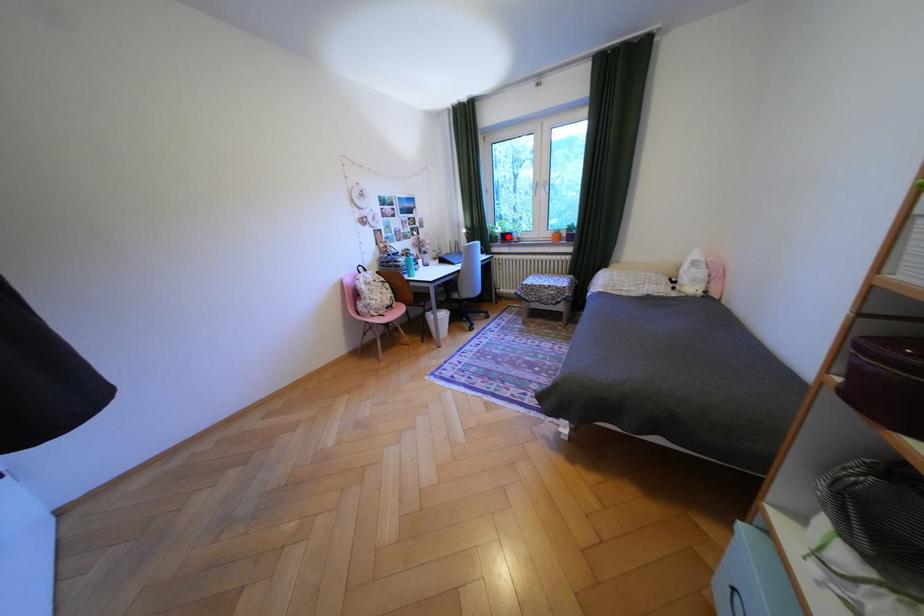
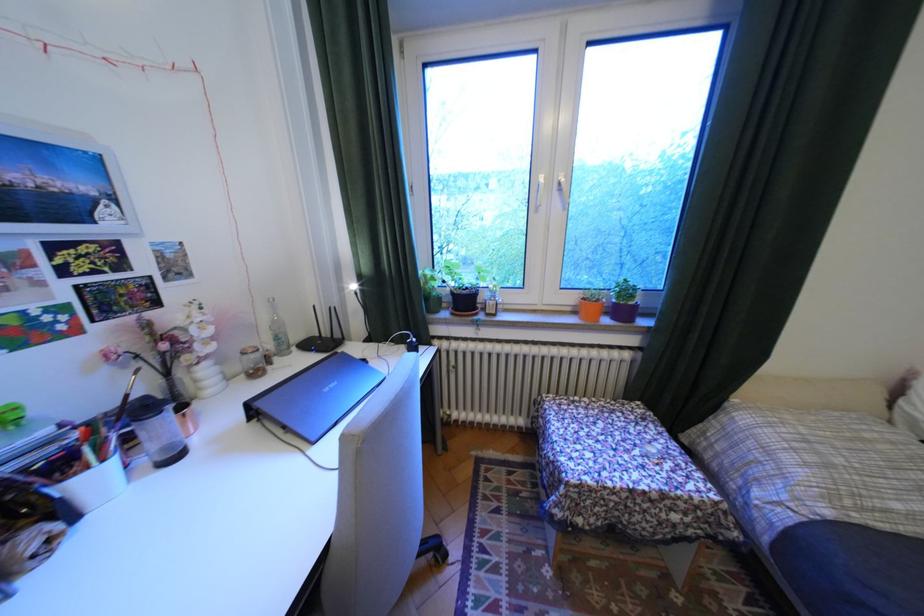
Locate, in the second image, the point that corresponds to the highlighted location in the first image.

(451, 299)